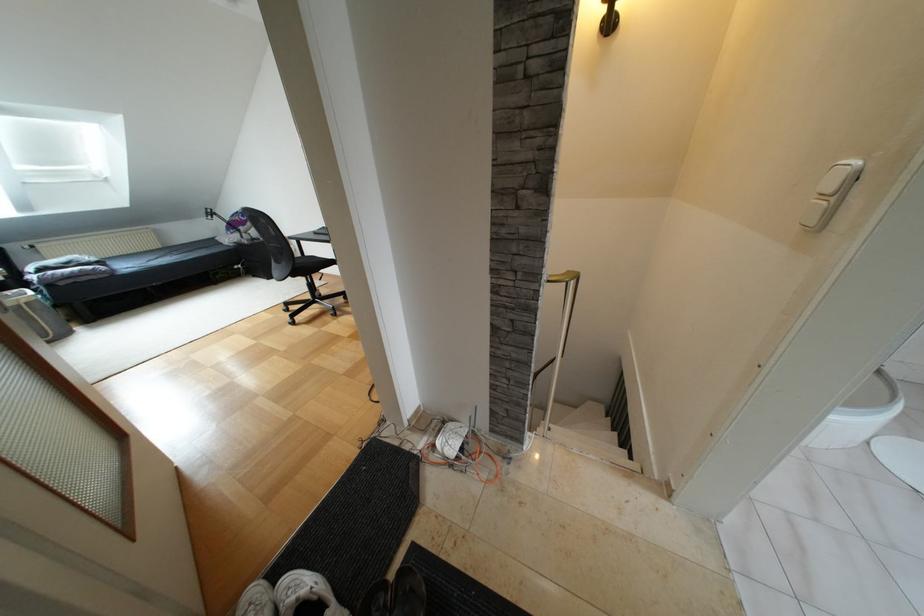
This screenshot has width=924, height=616. What do you see at coordinates (588, 431) in the screenshot? I see `the stair handrail` at bounding box center [588, 431].